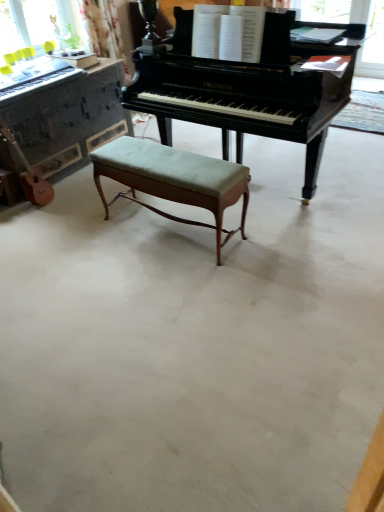
Where is `free space that is to the left of green fabric stool at center`? The height and width of the screenshot is (512, 384). free space that is to the left of green fabric stool at center is located at coordinates (82, 258).